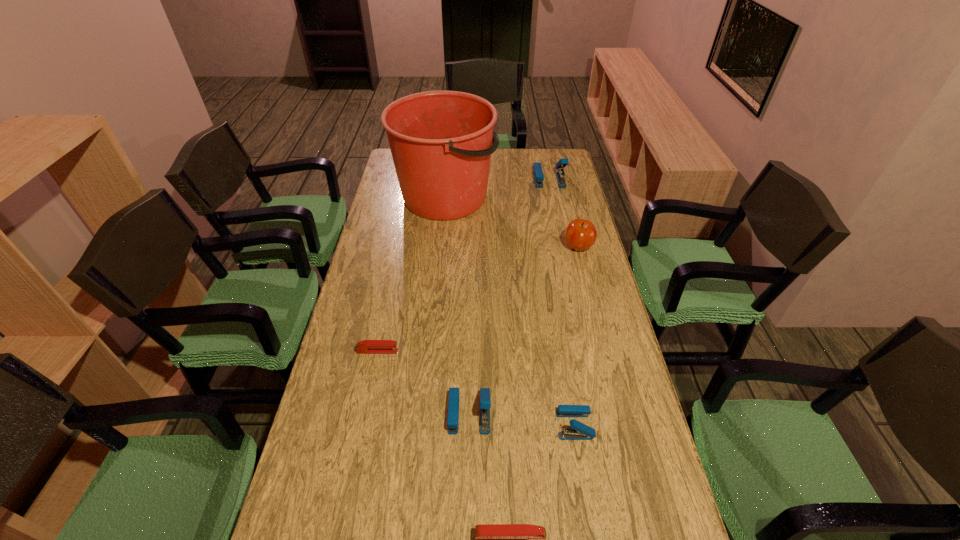
Identify the location of free space that satisfies the following two spatial constraints: 1. on the front-facing side of the farther red stapler; 2. on the right side of the smallest blue stapler. The image size is (960, 540). (362, 425).

This screenshot has width=960, height=540. What are the coordinates of `vacant region that satisfies the following two spatial constraints: 1. on the front-facing side of the fourth nearest stapler; 2. on the right side of the smallest blue stapler` in the screenshot? It's located at click(x=362, y=425).